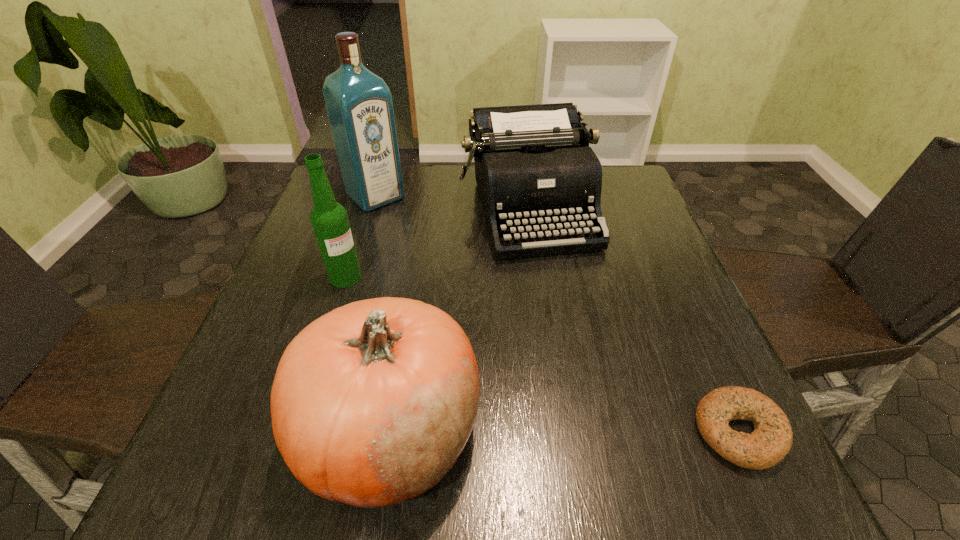
Identify the location of the second closest object to the typewriter. (329, 219).

Choose which object is the second nearest neighbor to the liquor. Please provide its 2D coordinates. Your answer should be formatted as a tuple, i.e. [(x, y)], where the tuple contains the x and y coordinates of a point satisfying the conditions above.

[(329, 219)]